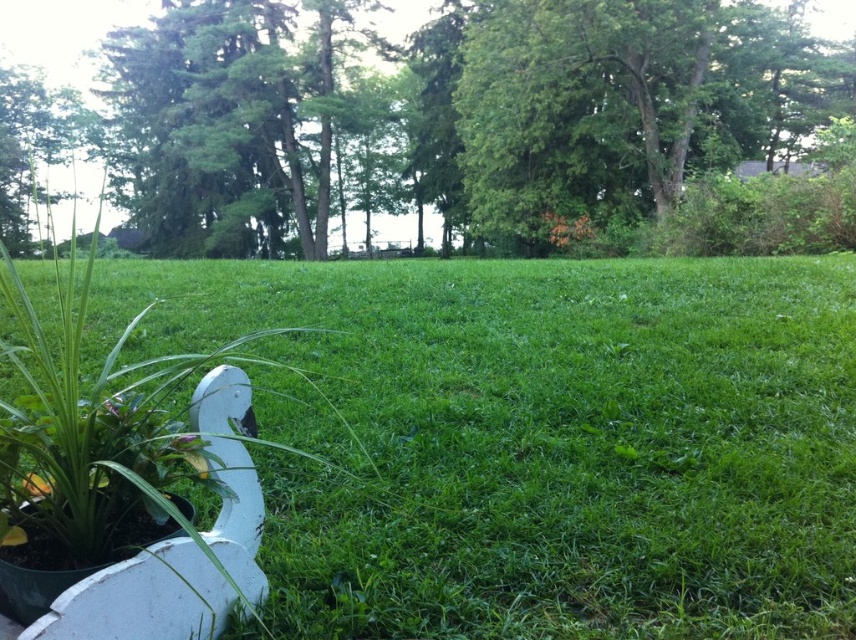
Between green leafy tree at upper center and orange matte flower at center, which one appears on the right side from the viewer's perspective?

From the viewer's perspective, orange matte flower at center appears more on the right side.

Which is in front, point (110, 19) or point (562, 237)?

Point (562, 237) is in front.

This screenshot has width=856, height=640. Find the location of `green leafy tree at upper center`. green leafy tree at upper center is located at coordinates (64, 35).

Who is higher up, green leafy tree at upper center or green leafy tree at upper left?

green leafy tree at upper center

Is green leafy tree at upper center below green leafy tree at upper left?

No, green leafy tree at upper center is not below green leafy tree at upper left.

Who is more distant from viewer, [117,10] or [16,72]?

The point [117,10] is more distant.

This screenshot has width=856, height=640. Identify the location of green leafy tree at upper center. (64, 35).

Is green leafy tree at upper center below green matte flower at lower left?

Incorrect, green leafy tree at upper center is not positioned below green matte flower at lower left.

Between green leafy tree at upper center and green matte flower at lower left, which one has less height?

With less height is green matte flower at lower left.

Does point (82, 76) lie in front of point (195, 435)?

No, (82, 76) is further to viewer.

This screenshot has height=640, width=856. What are the coordinates of `green leafy tree at upper center` in the screenshot? It's located at (64, 35).